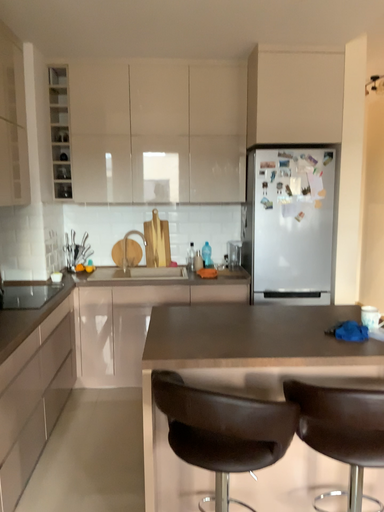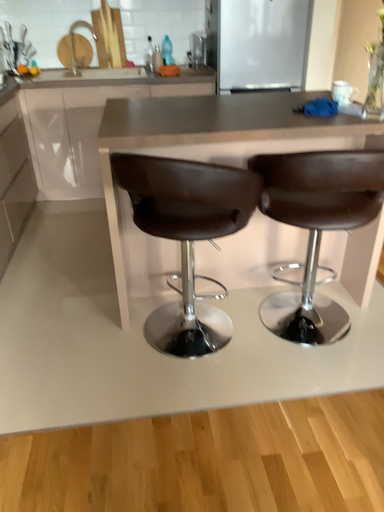
Question: How did the camera likely rotate when shooting the video?

Choices:
 (A) rotated upward
 (B) rotated downward

Answer: (B)